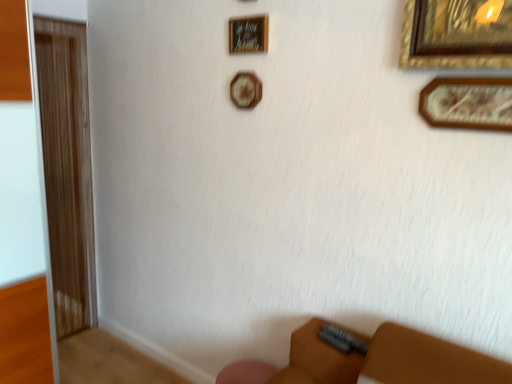
Question: Is wooden plaque at upper center, placed as the second picture frame when sorted from left to right, taller or shorter than wooden picture frame at upper center, arranged as the 2th picture frame when viewed from the top?

Choices:
 (A) short
 (B) tall

Answer: (A)

Question: Would you say wooden plaque at upper center, the 2th picture frame in the back-to-front sequence, is to the left or to the right of wooden picture frame at upper center, which ranks as the 3th picture frame in front-to-back order, in the picture?

Choices:
 (A) left
 (B) right

Answer: (B)

Question: Which of these objects is positioned closest to the brown wood screen door at left?

Choices:
 (A) wooden picture frame at upper center, which is the 3th picture frame from right to left
 (B) wooden picture frame at upper right, the 1th picture frame when ordered from right to left
 (C) wooden plaque at upper center, which is the 2th picture frame in front-to-back order

Answer: (A)

Question: Which of these objects is positioned closest to the wooden picture frame at upper center, the first picture frame positioned from the back?

Choices:
 (A) wooden picture frame at upper right, acting as the 3th picture frame starting from the top
 (B) brown wood screen door at left
 (C) wooden plaque at upper center, the 2th picture frame in the back-to-front sequence

Answer: (C)